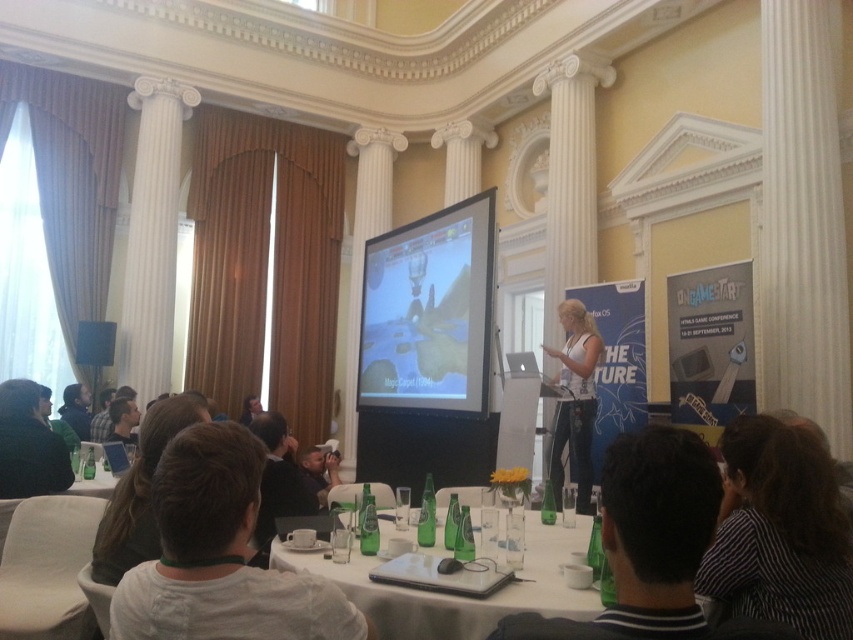
Between matte black screen at center and white glossy table at lower center, which one appears on the right side from the viewer's perspective?

From the viewer's perspective, white glossy table at lower center appears more on the right side.

Can you confirm if matte black screen at center is positioned below white glossy table at lower center?

No.

Between point (469, 314) and point (368, 595), which one is positioned behind?

The point (469, 314) is more distant.

This screenshot has width=853, height=640. I want to click on matte black screen at center, so click(428, 310).

You are a GUI agent. You are given a task and a screenshot of the screen. Output one action in this format:
    pyautogui.click(x=<x>, y=<y>)
    Task: Click on the matte black screen at center
    The width and height of the screenshot is (853, 640).
    Given the screenshot: What is the action you would take?
    pyautogui.click(x=428, y=310)

Is matte black screen at center smaller than green glass bottles at lower left?

Actually, matte black screen at center might be larger than green glass bottles at lower left.

Measure the distance between point (x=422, y=218) and camera.

11.25 meters

Identify the location of matte black screen at center. This screenshot has width=853, height=640. (428, 310).

Does black striped shirt at lower right have a smaller size compared to white glossy table at lower center?

Indeed, black striped shirt at lower right has a smaller size compared to white glossy table at lower center.

Can you confirm if black striped shirt at lower right is taller than white glossy table at lower center?

Correct, black striped shirt at lower right is much taller as white glossy table at lower center.

Locate an element on the screen. The width and height of the screenshot is (853, 640). black striped shirt at lower right is located at coordinates (780, 531).

Find the location of a particular element. The width and height of the screenshot is (853, 640). black striped shirt at lower right is located at coordinates (780, 531).